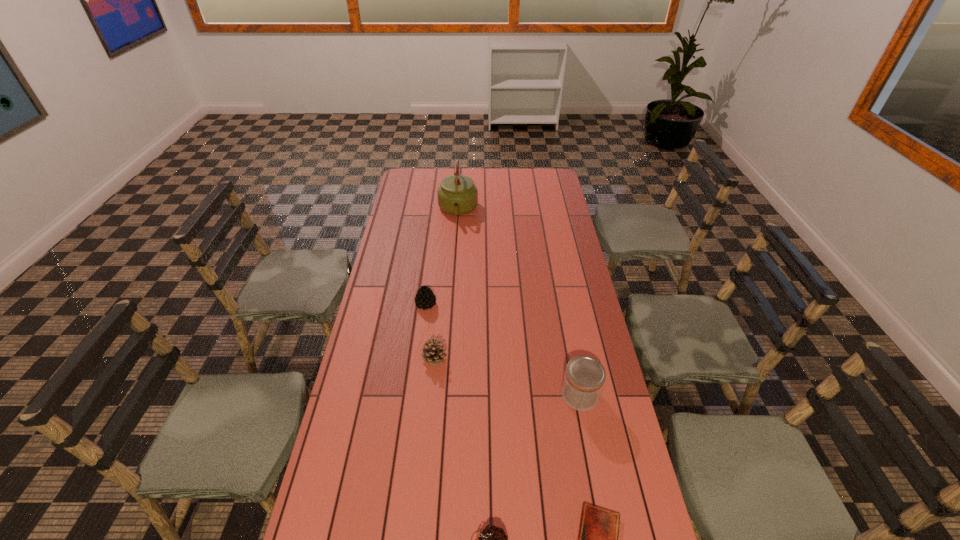
Identify the location of object that is at the right edge. The width and height of the screenshot is (960, 540). (584, 378).

The image size is (960, 540). Find the location of `vacant space at the far edge of the desktop`. vacant space at the far edge of the desktop is located at coordinates (482, 190).

I want to click on vacant region at the left edge of the desktop, so click(402, 302).

This screenshot has height=540, width=960. I want to click on vacant area at the right edge of the desktop, so click(x=580, y=329).

The width and height of the screenshot is (960, 540). Find the location of `free space at the far right corner of the desktop`. free space at the far right corner of the desktop is located at coordinates (557, 183).

Identify the location of free space between the farthest object and the jar. (518, 302).

Identify the location of blank region between the kettle and the third farthest object. This screenshot has width=960, height=540. (445, 284).

Find the location of a particular element. This screenshot has height=540, width=960. free area in between the farthest pinecone and the second farthest pinecone is located at coordinates (430, 331).

At what (x,y) coordinates should I click in order to perform the action: click on free space that is in between the jar and the farthest object. Please return your answer as a coordinate pair (x, y). Image resolution: width=960 pixels, height=540 pixels. Looking at the image, I should click on (518, 302).

The height and width of the screenshot is (540, 960). Identify the location of object that ranks as the closest to the fourth nearest object. (425, 298).